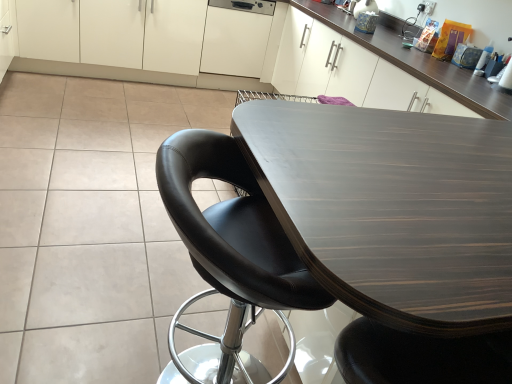
Question: From the image's perspective, relative to dark wood table at center, is black leather chair at center above or below?

Choices:
 (A) above
 (B) below

Answer: (A)

Question: In terms of width, does black leather chair at center look wider or thinner when compared to dark wood table at center?

Choices:
 (A) wide
 (B) thin

Answer: (B)

Question: Which object is positioned farthest from the white glossy cabinets at upper center, which is the first cabinetry in left-to-right order?

Choices:
 (A) dark wood table at center
 (B) white matte cabinet at center, the 1th cabinetry when ordered from right to left
 (C) black leather chair at center

Answer: (A)

Question: Which of these objects is positioned farthest from the white matte cabinet at center, which is counted as the second cabinetry, starting from the left?

Choices:
 (A) dark wood table at center
 (B) white glossy cabinets at upper center, which is the first cabinetry in left-to-right order
 (C) black leather chair at center

Answer: (C)